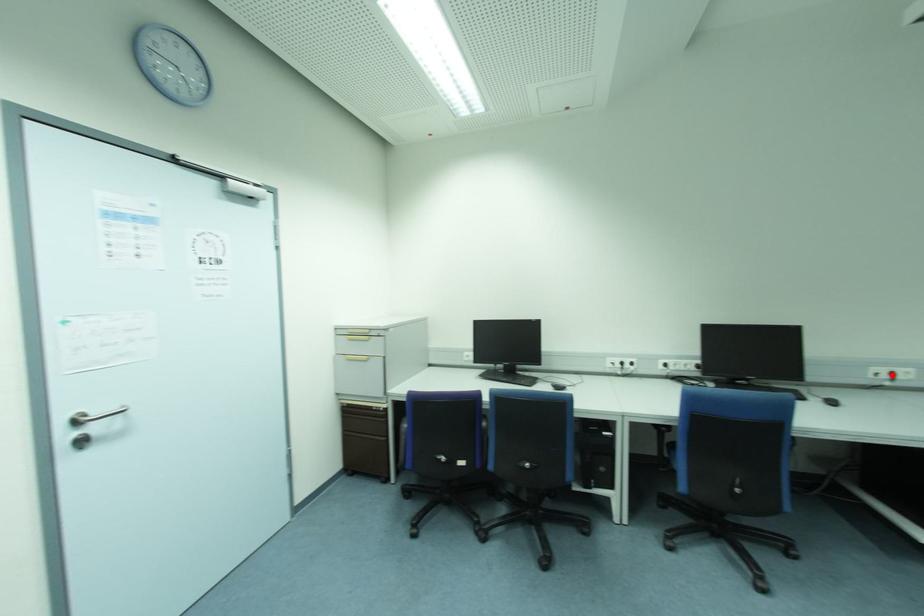
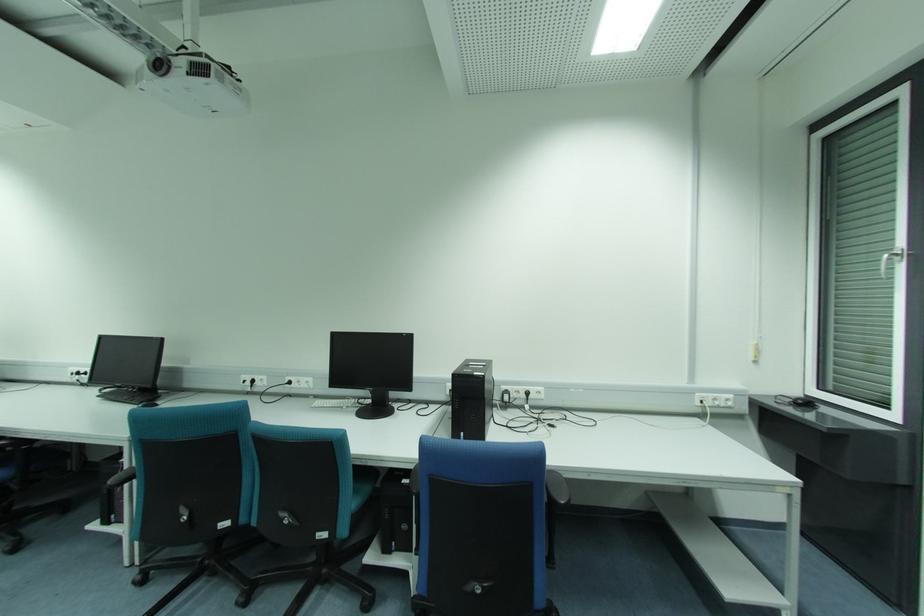
The point at the highlighted location is marked in the first image. Where is the corresponding point in the second image?

(253, 381)